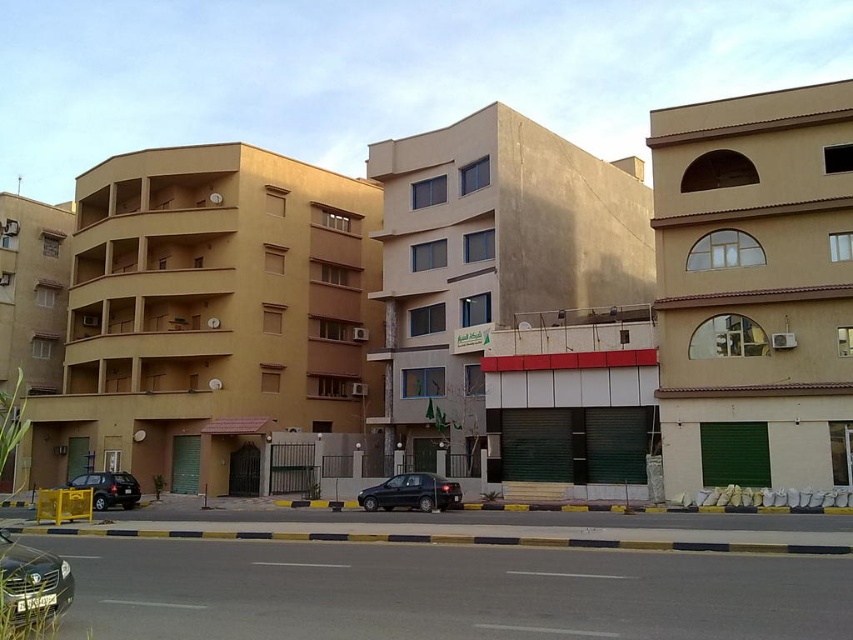
You are a delivery person needing to park a 5.5 meter long delivery van between the shiny black sedan at lower left and the matte black suv at left. Can the van fit in the space between them?

The space between the shiny black sedan at lower left and the matte black suv at left is 21.00 meters. Since the van is only 5.5 meters long, there is more than enough space to park it between them.

You are a delivery person trying to park your van between the shiny black sedan at center and the matte black suv at left. Can you fit your van there if it requires 3 meters of space?

The shiny black sedan at center is positioned over the matte black suv at left, which means there is no space between them. Your van requiring 3 meters cannot fit between them.

You are standing at the point marked by the coordinates point (32, 582) in the image. Which vehicle are you currently standing on?

The point (32, 582) is on the shiny black sedan at lower left, so you are standing on the shiny black sedan at lower left.